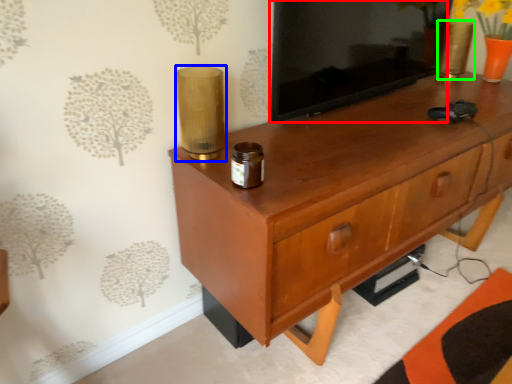
Question: Which object is positioned closest to tv cabinet (highlighted by a red box)? Select from candle holder (highlighted by a blue box) and candle holder (highlighted by a green box).

Choices:
 (A) candle holder
 (B) candle holder

Answer: (A)